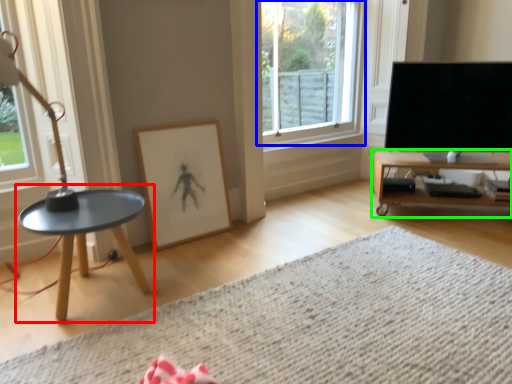
Question: Considering the real-world distances, which object is closest to coffee table (highlighted by a red box)? window (highlighted by a blue box) or table (highlighted by a green box).

Choices:
 (A) window
 (B) table

Answer: (A)